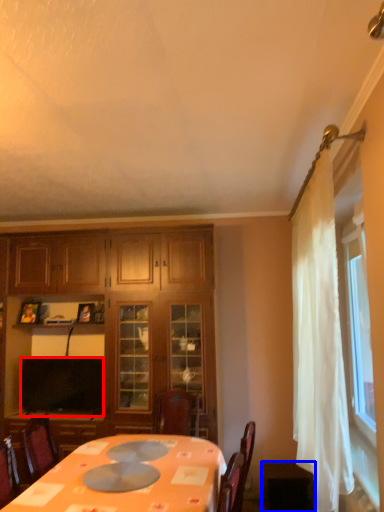
Question: Among these objects, which one is farthest to the camera, television (highlighted by a red box) or table (highlighted by a blue box)?

Choices:
 (A) television
 (B) table

Answer: (A)